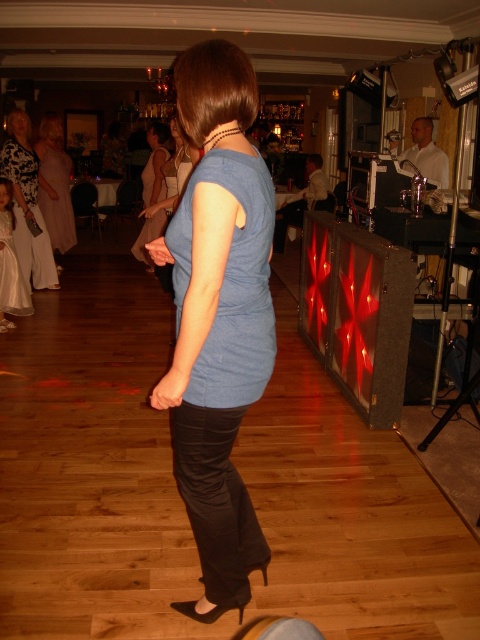
Question: Does white satin dress at left appear under satin beige dress at center?

Choices:
 (A) yes
 (B) no

Answer: (A)

Question: Can you confirm if matte blue shirt at center is positioned to the right of white satin dress at lower left?

Choices:
 (A) yes
 (B) no

Answer: (A)

Question: Which point is closer to the camera?

Choices:
 (A) satin beige dress at center
 (B) white satin dress at lower left
 (C) matte blue shirt at center

Answer: (C)

Question: Does matte blue shirt at center have a greater width compared to satin beige dress at center?

Choices:
 (A) no
 (B) yes

Answer: (A)

Question: Which of the following is the closest to the observer?

Choices:
 (A) (14, 278)
 (B) (49, 129)
 (C) (136, 246)

Answer: (A)

Question: Which object is the farthest from the matte blue shirt at center?

Choices:
 (A) white satin dress at lower left
 (B) satin beige dress at center
 (C) white satin dress at left

Answer: (C)